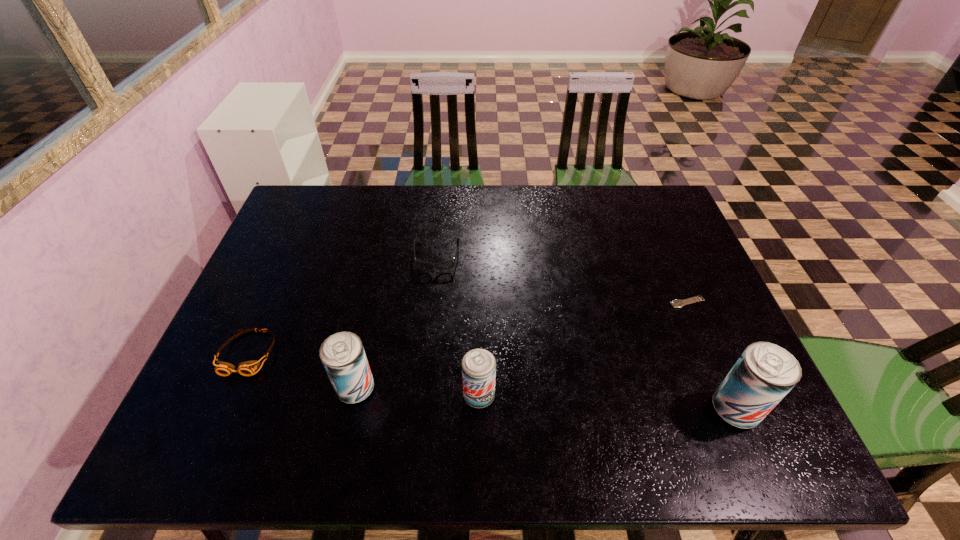
Identify the location of free space located on the back of the second shortest beer can. This screenshot has width=960, height=540. (381, 272).

Where is `vacant space located 0.150m on the back of the shortest beer can`? vacant space located 0.150m on the back of the shortest beer can is located at coordinates (479, 329).

The height and width of the screenshot is (540, 960). Find the location of `free location located 0.250m on the left of the rightmost beer can`. free location located 0.250m on the left of the rightmost beer can is located at coordinates (597, 409).

I want to click on free space located 0.140m on the left of the watch, so click(616, 302).

I want to click on vacant area situated 0.100m on the front-facing side of the spectacles, so click(433, 300).

Locate an element on the screen. goggles that is at the near edge is located at coordinates (247, 368).

I want to click on object located at the left edge, so click(247, 368).

Where is `beer can present at the right edge`? The height and width of the screenshot is (540, 960). beer can present at the right edge is located at coordinates (764, 374).

Identify the location of watch located at the right edge. (675, 303).

This screenshot has width=960, height=540. Find the location of `object that is at the near left corner`. object that is at the near left corner is located at coordinates (247, 368).